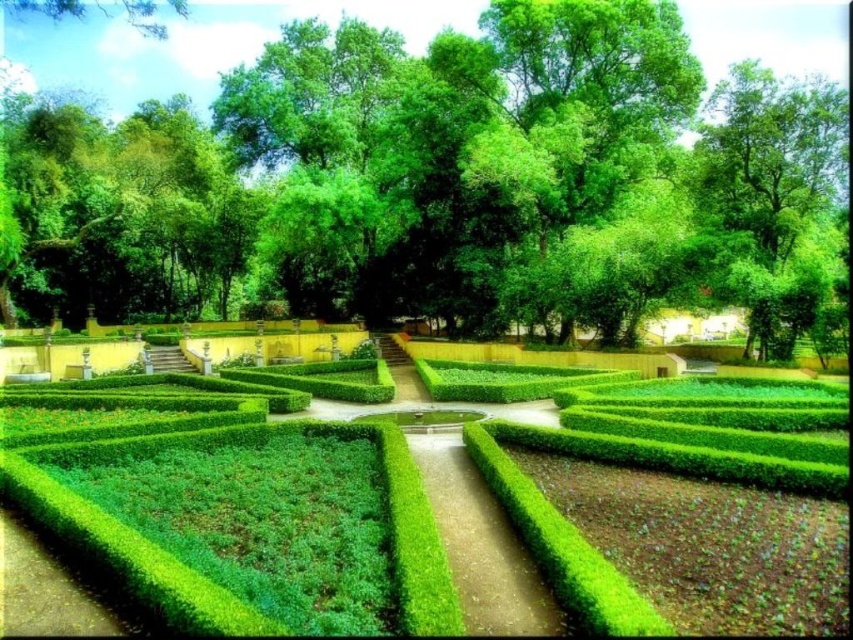
You are standing at the entrance of the garden and want to take a photo of the green leafy tree at upper center. Which direction should you face to ensure the tree is in the center of your camera view?

The green leafy tree at upper center is located at point coordinates, so you should face the upper center direction to have it centered in your camera view.

You are standing at the entrance of the garden and want to reach the water feature at the center. You see the green leafy tree at upper center and the green hedge at center. Which object is closer to you?

The green hedge at center is closer to you than the green leafy tree at upper center because the green leafy tree at upper center is 106.69 feet away from the green hedge at center, implying the hedge is nearer to the entrance.

You are standing at the entrance of the garden and want to walk towards the green hedge maze at center. Which direction should you walk to avoid the green leafy tree at upper center?

Since the green leafy tree at upper center is to the left of the green hedge maze at center, you should walk to the right of the green leafy tree at upper center to avoid it and reach the green hedge maze at center.